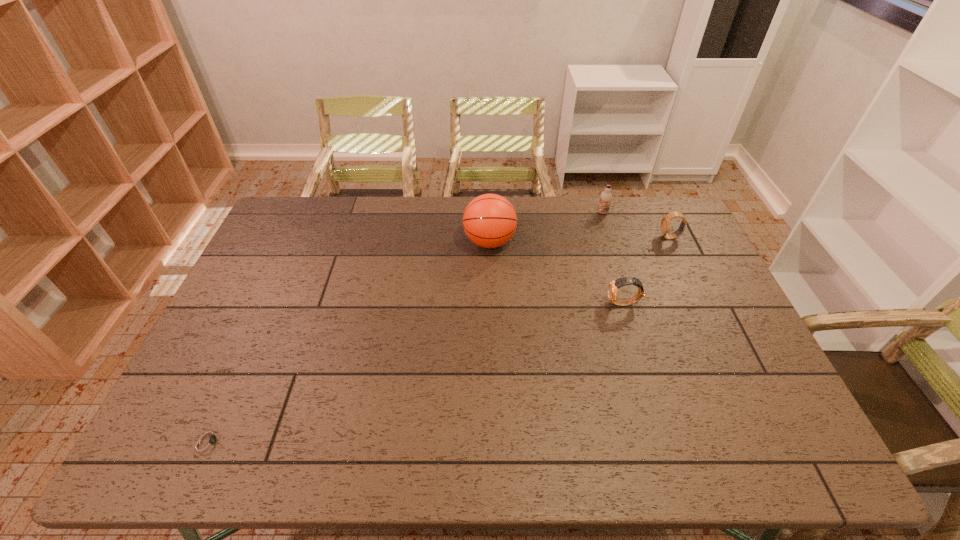
Find the location of a particular element. The height and width of the screenshot is (540, 960). basketball is located at coordinates (489, 220).

Identify the location of the tallest object. The height and width of the screenshot is (540, 960). (489, 220).

Find the location of a particular element. This screenshot has width=960, height=540. the farthest object is located at coordinates [606, 197].

Where is `the rightmost object`? This screenshot has height=540, width=960. the rightmost object is located at coordinates (665, 226).

The image size is (960, 540). What are the coordinates of `the farthest watch` in the screenshot? It's located at (665, 226).

Locate an element on the screen. This screenshot has width=960, height=540. the second nearest watch is located at coordinates (614, 285).

Find the location of `the second nearest object`. the second nearest object is located at coordinates (614, 285).

I want to click on the shortest object, so click(209, 440).

Locate an element on the screen. Image resolution: width=960 pixels, height=540 pixels. the leftmost object is located at coordinates (209, 440).

This screenshot has width=960, height=540. What are the coordinates of `free region located 0.180m on the back of the fourth object from right to left` in the screenshot? It's located at (489, 197).